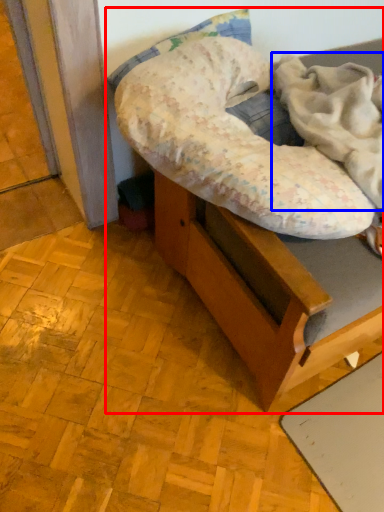
Question: Which object is further to the camera taking this photo, furniture (highlighted by a red box) or blanket (highlighted by a blue box)?

Choices:
 (A) furniture
 (B) blanket

Answer: (A)